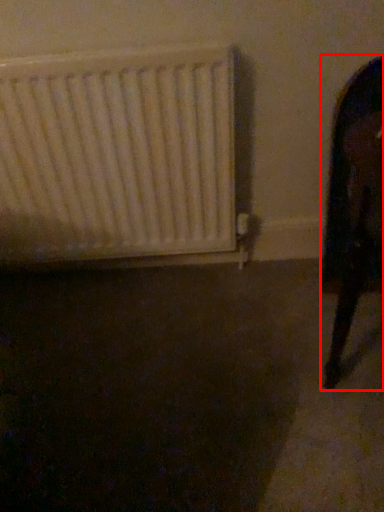
Question: Considering the relative positions of furniture (annotated by the red box) and radiator in the image provided, where is furniture (annotated by the red box) located with respect to the staircase?

Choices:
 (A) right
 (B) left

Answer: (A)